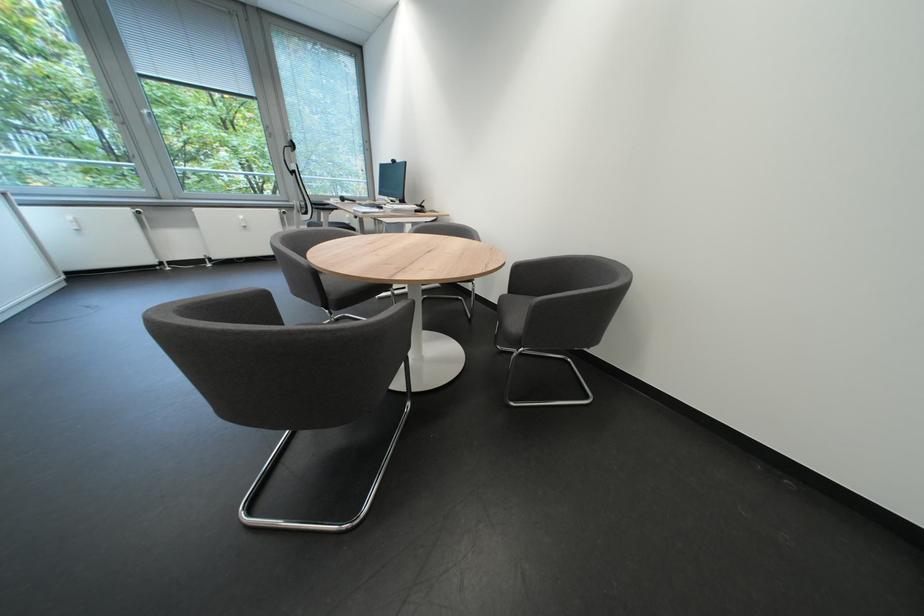
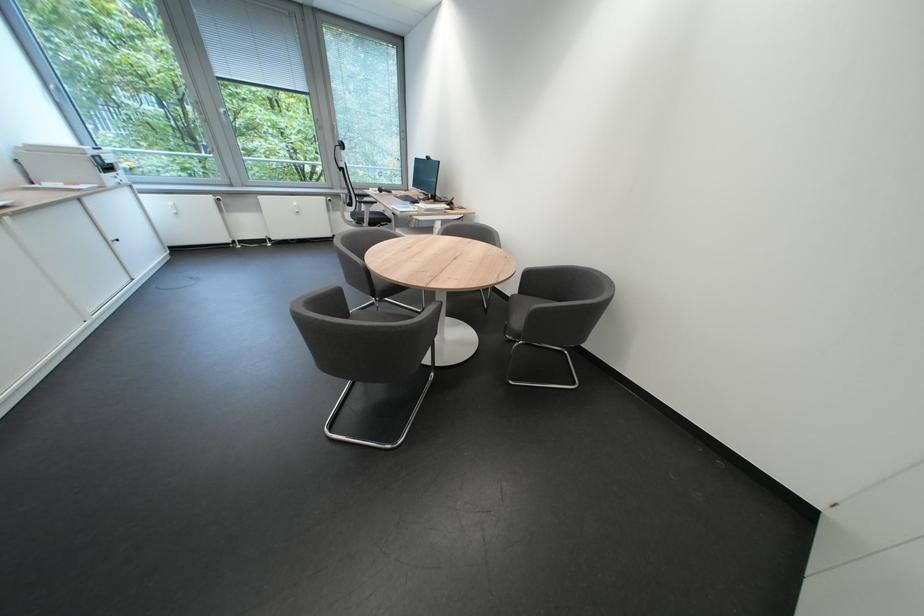
Where in the second image is the point corresponding to point 507,345 from the first image?

(517, 334)